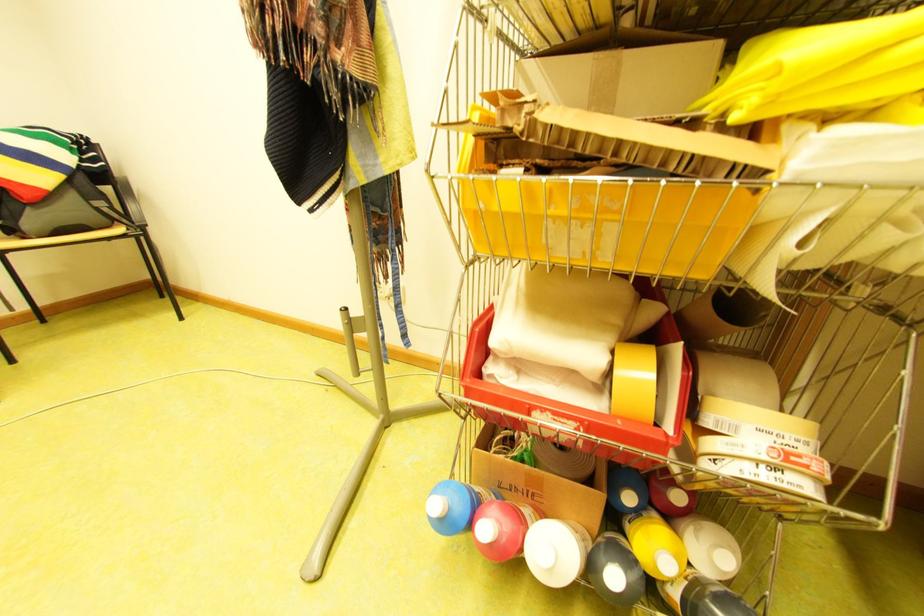
Which object does [634,382] point to?

It corresponds to the roll of yellow tape in the image.